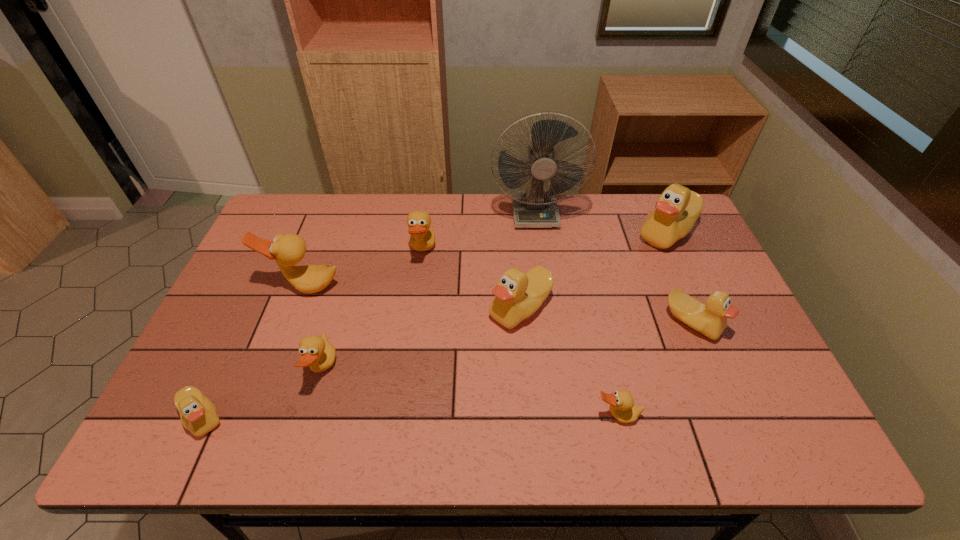
Identify which object is the fifth nearest to the fourth duck from right to left. Please provide its 2D coordinates. Your answer should be formatted as a tuple, i.e. [(x, y)], where the tuple contains the x and y coordinates of a point satisfying the conditions above.

[(676, 211)]

Locate an element on the screen. The width and height of the screenshot is (960, 540). the eighth closest object to the third beige duck from right to left is located at coordinates (198, 414).

This screenshot has height=540, width=960. I want to click on duck that is the fourth closest one to the nearest beige duck, so click(x=518, y=295).

Select which duck is the fifth closest to the third biggest tan duck. Please provide its 2D coordinates. Your answer should be formatted as a tuple, i.e. [(x, y)], where the tuple contains the x and y coordinates of a point satisfying the conditions above.

[(622, 407)]

This screenshot has height=540, width=960. I want to click on beige duck that can be found as the second closest to the third biggest tan duck, so click(518, 295).

Locate an element on the screen. The width and height of the screenshot is (960, 540). beige duck identified as the third closest to the farthest beige duck is located at coordinates (198, 414).

Find the location of a particular element. Image resolution: width=960 pixels, height=540 pixels. tan duck object that ranks as the closest to the third tan duck from left to right is located at coordinates (289, 249).

Locate which tan duck ranks second in proximity to the nearest beige duck. Please provide its 2D coordinates. Your answer should be formatted as a tuple, i.e. [(x, y)], where the tuple contains the x and y coordinates of a point satisfying the conditions above.

[(289, 249)]

Find the location of `free location that satisfies the following two spatial constraints: 1. at the beak of the biggest beige duck; 2. at the beak of the leftmost beige duck`. free location that satisfies the following two spatial constraints: 1. at the beak of the biggest beige duck; 2. at the beak of the leftmost beige duck is located at coordinates (751, 417).

The width and height of the screenshot is (960, 540). In order to click on free point that satisfies the following two spatial constraints: 1. at the beak of the biggest beige duck; 2. on the beak of the rightmost tan duck in this screenshot , I will do `click(750, 416)`.